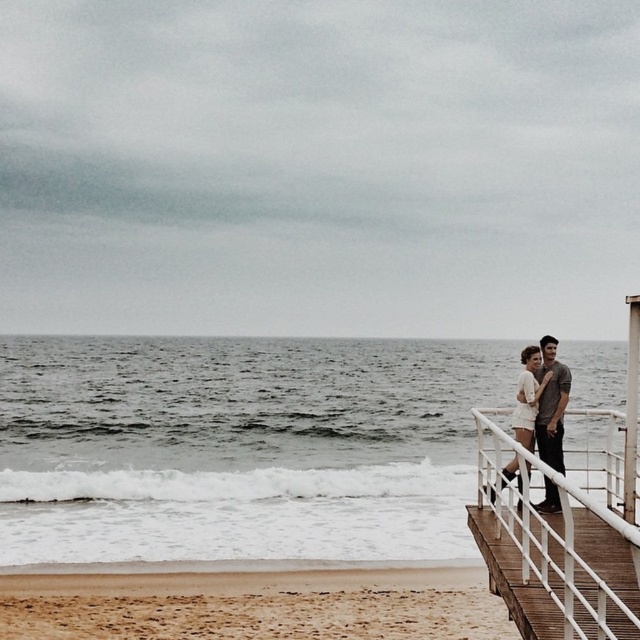
Question: Among these objects, which one is farthest from the camera?

Choices:
 (A) white wooden railing at right
 (B) dark gray jeans at right
 (C) white cotton dress at right

Answer: (B)

Question: From the image, what is the correct spatial relationship of white wooden railing at right in relation to dark gray jeans at right?

Choices:
 (A) above
 (B) below

Answer: (B)

Question: Which object is positioned closest to the white cotton dress at right?

Choices:
 (A) dark gray jeans at right
 (B) white wooden railing at right

Answer: (A)

Question: Does white wooden railing at right appear on the left side of dark gray jeans at right?

Choices:
 (A) no
 (B) yes

Answer: (A)

Question: Which point is closer to the camera taking this photo?

Choices:
 (A) (570, 380)
 (B) (552, 419)
 (C) (593, 493)
 (D) (52, 584)

Answer: (B)

Question: Is white wooden railing at right positioned in front of white cotton dress at right?

Choices:
 (A) no
 (B) yes

Answer: (B)